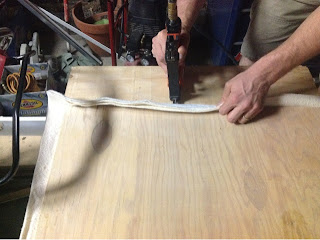
Where is `wood floor`? This screenshot has width=320, height=240. wood floor is located at coordinates (16, 206).